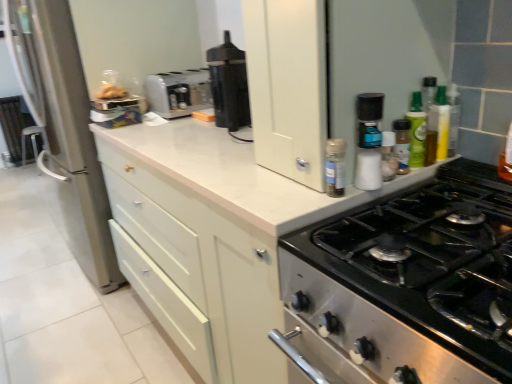
Question: Can you confirm if white plastic spice rack at upper right is thinner than translucent plastic spice jar at upper right, arranged as the 3th bottle when viewed from the left?

Choices:
 (A) yes
 (B) no

Answer: (B)

Question: Can you confirm if white plastic spice rack at upper right is bigger than translucent plastic spice jar at upper right, arranged as the 3th bottle when viewed from the left?

Choices:
 (A) no
 (B) yes

Answer: (B)

Question: From the image's perspective, is white plastic spice rack at upper right located beneath translucent plastic spice jar at upper right, which ranks as the second bottle in right-to-left order?

Choices:
 (A) no
 (B) yes

Answer: (A)

Question: Is white plastic spice rack at upper right completely or partially outside of translucent plastic spice jar at upper right, arranged as the 3th bottle when viewed from the left?

Choices:
 (A) yes
 (B) no

Answer: (A)

Question: Is white plastic spice rack at upper right beside translucent plastic spice jar at upper right, arranged as the 3th bottle when viewed from the left?

Choices:
 (A) yes
 (B) no

Answer: (B)

Question: From a real-world perspective, is white plastic spice rack at upper right under translucent plastic spice jar at upper right, which ranks as the second bottle in right-to-left order?

Choices:
 (A) yes
 (B) no

Answer: (B)

Question: From the image's perspective, would you say white plastic toaster at center is positioned over white plastic salt shaker at upper right, the 4th bottle when ordered from right to left?

Choices:
 (A) no
 (B) yes

Answer: (B)

Question: Is white plastic salt shaker at upper right, marked as the 1th bottle in a left-to-right arrangement, a part of white plastic toaster at center?

Choices:
 (A) no
 (B) yes

Answer: (A)

Question: Does white plastic toaster at center turn towards white plastic salt shaker at upper right, marked as the 1th bottle in a left-to-right arrangement?

Choices:
 (A) no
 (B) yes

Answer: (B)

Question: Can you confirm if white plastic toaster at center is bigger than white plastic salt shaker at upper right, the 4th bottle when ordered from right to left?

Choices:
 (A) yes
 (B) no

Answer: (A)

Question: Is white plastic toaster at center closer to the viewer compared to white plastic salt shaker at upper right, marked as the 1th bottle in a left-to-right arrangement?

Choices:
 (A) yes
 (B) no

Answer: (B)

Question: From a real-world perspective, is white plastic toaster at center physically above white plastic salt shaker at upper right, marked as the 1th bottle in a left-to-right arrangement?

Choices:
 (A) yes
 (B) no

Answer: (A)

Question: Is white plastic salt shaker at upper right, the 4th bottle when ordered from right to left, thinner than white matte cabinet at upper center?

Choices:
 (A) yes
 (B) no

Answer: (A)